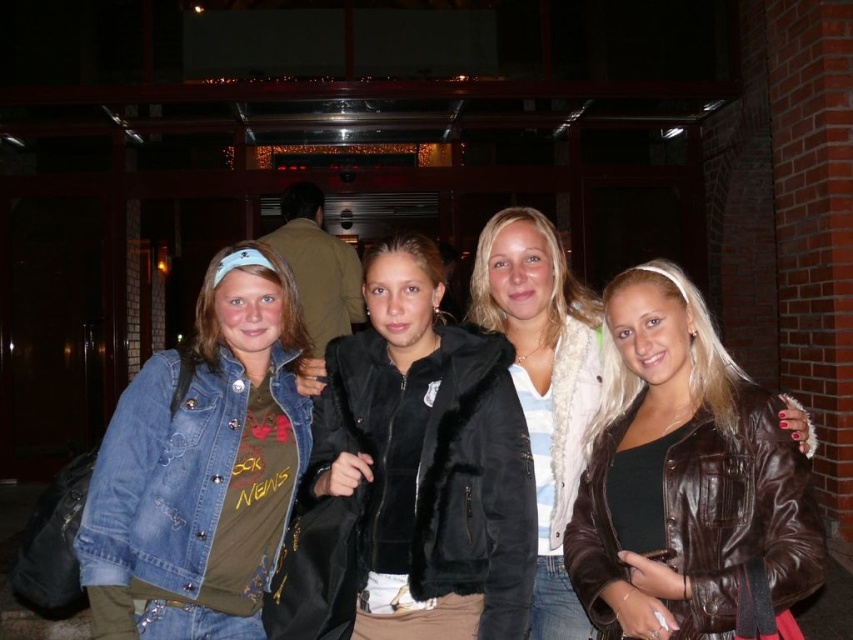
From the picture: Between brown leather jacket at right and denim jacket at lower left, which one appears on the right side from the viewer's perspective?

From the viewer's perspective, brown leather jacket at right appears more on the right side.

Where is `brown leather jacket at right`? The height and width of the screenshot is (640, 853). brown leather jacket at right is located at coordinates (685, 477).

Is black fur jacket at center thinner than white fur coat at center?

In fact, black fur jacket at center might be wider than white fur coat at center.

Is point (344, 452) positioned before point (538, 422)?

Yes, it is in front of point (538, 422).

Is point (473, 356) farther from camera compared to point (582, 294)?

No, it is in front of (582, 294).

The height and width of the screenshot is (640, 853). Find the location of `black fur jacket at center`. black fur jacket at center is located at coordinates (416, 470).

Is black fur jacket at center shorter than denim jacket at lower left?

Yes, black fur jacket at center is shorter than denim jacket at lower left.

Who is shorter, black fur jacket at center or denim jacket at lower left?

black fur jacket at center

What do you see at coordinates (416, 470) in the screenshot? I see `black fur jacket at center` at bounding box center [416, 470].

This screenshot has height=640, width=853. What are the coordinates of `black fur jacket at center` in the screenshot? It's located at (416, 470).